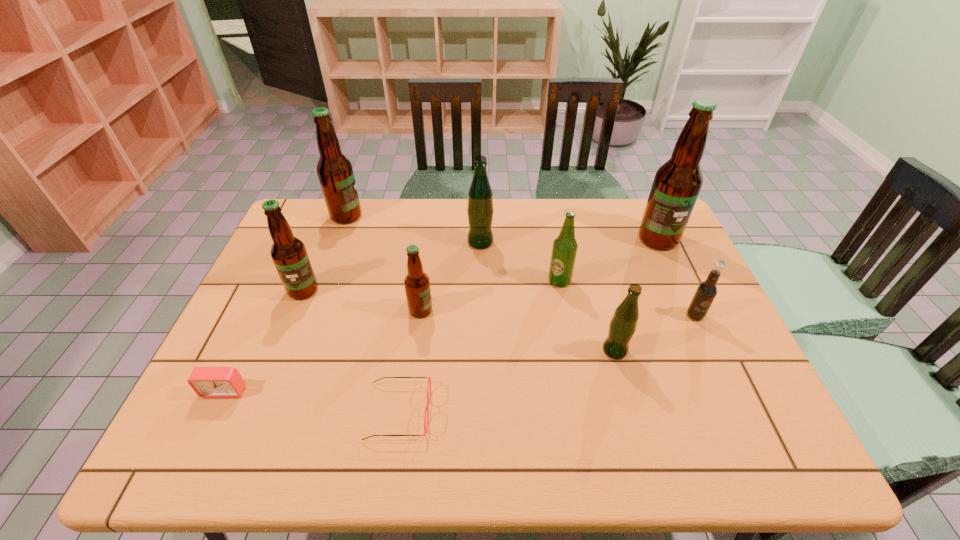
Identify the location of blank space that satisfies the following two spatial constraints: 1. on the label of the nearest beer bottle; 2. on the left side of the third farthest brown beer bottle. (279, 350).

The image size is (960, 540). I want to click on free region that satisfies the following two spatial constraints: 1. on the label of the nearest brown beer bottle; 2. on the left side of the rightmost green beer bottle, so click(416, 350).

Image resolution: width=960 pixels, height=540 pixels. I want to click on vacant space that satisfies the following two spatial constraints: 1. on the front side of the fourth beer bottle from left to right; 2. on the front-facing side of the red spectacles, so click(x=481, y=412).

I want to click on vacant region that satisfies the following two spatial constraints: 1. on the label of the tallest beer bottle; 2. on the label of the nearest brown beer bottle, so click(x=690, y=310).